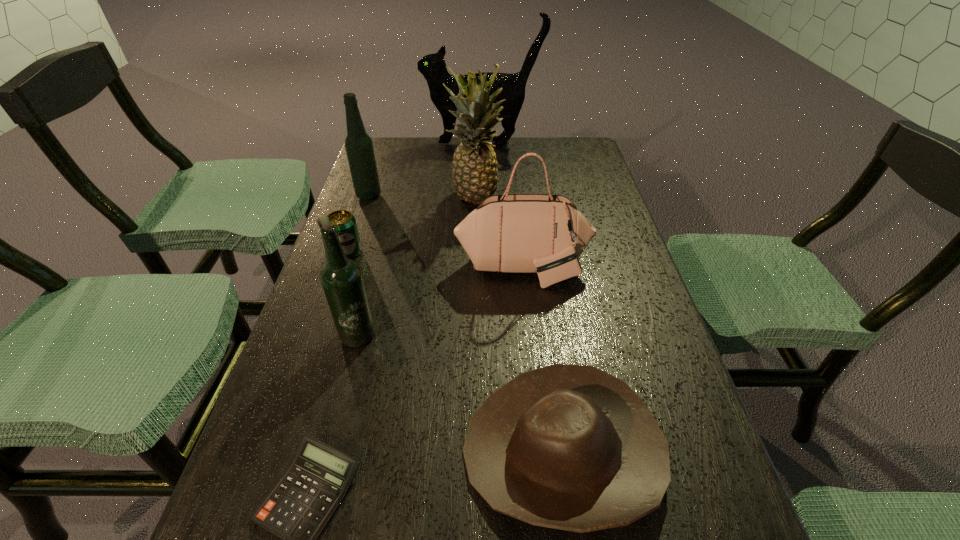
Locate an element on the screen. This screenshot has width=960, height=540. object that ranks as the fourth closest to the farthest object is located at coordinates (545, 234).